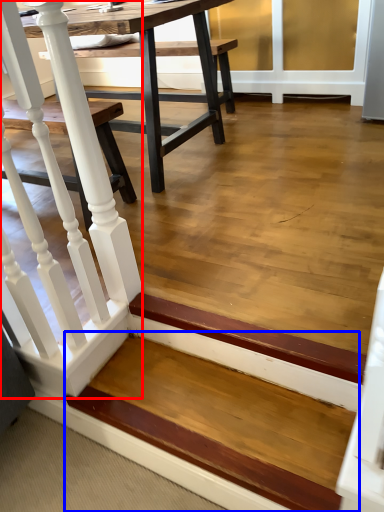
Question: Among these objects, which one is nearest to the camera, rail (highlighted by a red box) or stairwell (highlighted by a blue box)?

Choices:
 (A) rail
 (B) stairwell

Answer: (A)